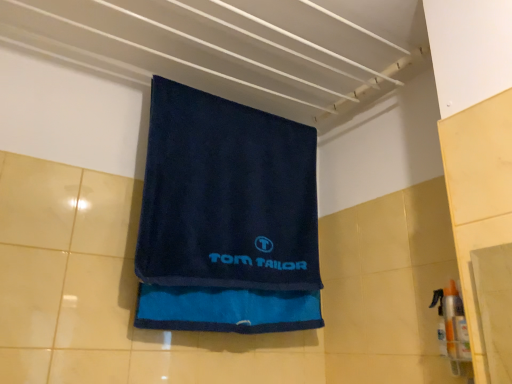
Describe the element at coordinates (226, 196) in the screenshot. I see `navy blue towel at center` at that location.

In order to face navy blue towel at center, should I rotate leftwards or rightwards?

You should look left and rotate roughly 1.568 degrees.

The width and height of the screenshot is (512, 384). Identify the location of navy blue towel at center. (226, 196).

Find the location of a particular element. navy blue towel at center is located at coordinates (226, 196).